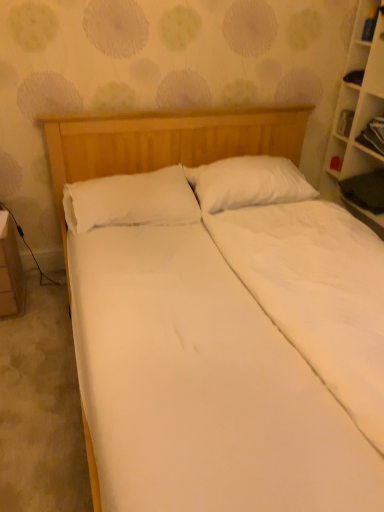
Question: Is white wooden bookcase at right turned away from wooden cabinet at right?

Choices:
 (A) yes
 (B) no

Answer: (A)

Question: Does white wooden bookcase at right have a greater height compared to wooden cabinet at right?

Choices:
 (A) yes
 (B) no

Answer: (A)

Question: Does white wooden bookcase at right lie behind wooden cabinet at right?

Choices:
 (A) no
 (B) yes

Answer: (A)

Question: Can you confirm if white wooden bookcase at right is thinner than wooden cabinet at right?

Choices:
 (A) yes
 (B) no

Answer: (B)

Question: Is white wooden bookcase at right placed right next to wooden cabinet at right?

Choices:
 (A) no
 (B) yes

Answer: (A)

Question: Relative to white soft pillow at center, the 2th pillow from the right, is white glossy table at lower left in front or behind?

Choices:
 (A) behind
 (B) front

Answer: (A)

Question: Choose the correct answer: Is white glossy table at lower left inside white soft pillow at center, the 2th pillow from the right, or outside it?

Choices:
 (A) inside
 (B) outside

Answer: (B)

Question: Is white glossy table at lower left bigger or smaller than white soft pillow at center, marked as the first pillow in a left-to-right arrangement?

Choices:
 (A) big
 (B) small

Answer: (B)

Question: In terms of height, does white glossy table at lower left look taller or shorter compared to white soft pillow at center, the 2th pillow from the right?

Choices:
 (A) short
 (B) tall

Answer: (B)

Question: Considering the positions of white wooden bookcase at right and wooden cabinet at right in the image, is white wooden bookcase at right taller or shorter than wooden cabinet at right?

Choices:
 (A) tall
 (B) short

Answer: (A)

Question: In the image, is white wooden bookcase at right on the left side or the right side of wooden cabinet at right?

Choices:
 (A) right
 (B) left

Answer: (A)

Question: Considering the positions of white wooden bookcase at right and wooden cabinet at right in the image, is white wooden bookcase at right wider or thinner than wooden cabinet at right?

Choices:
 (A) wide
 (B) thin

Answer: (A)

Question: From the image's perspective, is white wooden bookcase at right above or below wooden cabinet at right?

Choices:
 (A) above
 (B) below

Answer: (B)

Question: Does point (150, 214) appear closer or farther from the camera than point (329, 174)?

Choices:
 (A) farther
 (B) closer

Answer: (B)

Question: Considering the positions of white soft pillow at center, marked as the first pillow in a left-to-right arrangement, and white wooden bookcase at right in the image, is white soft pillow at center, marked as the first pillow in a left-to-right arrangement, wider or thinner than white wooden bookcase at right?

Choices:
 (A) thin
 (B) wide

Answer: (B)